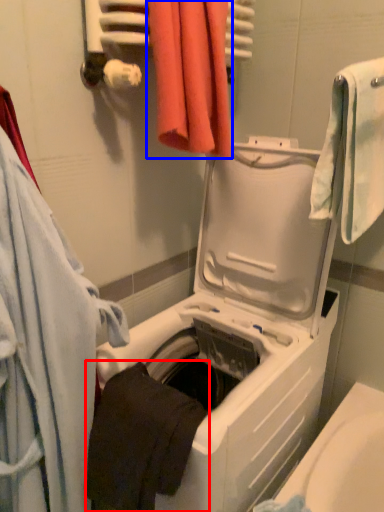
Question: Which object appears closest to the camera in this image, towel (highlighted by a red box) or towel (highlighted by a blue box)?

Choices:
 (A) towel
 (B) towel

Answer: (A)